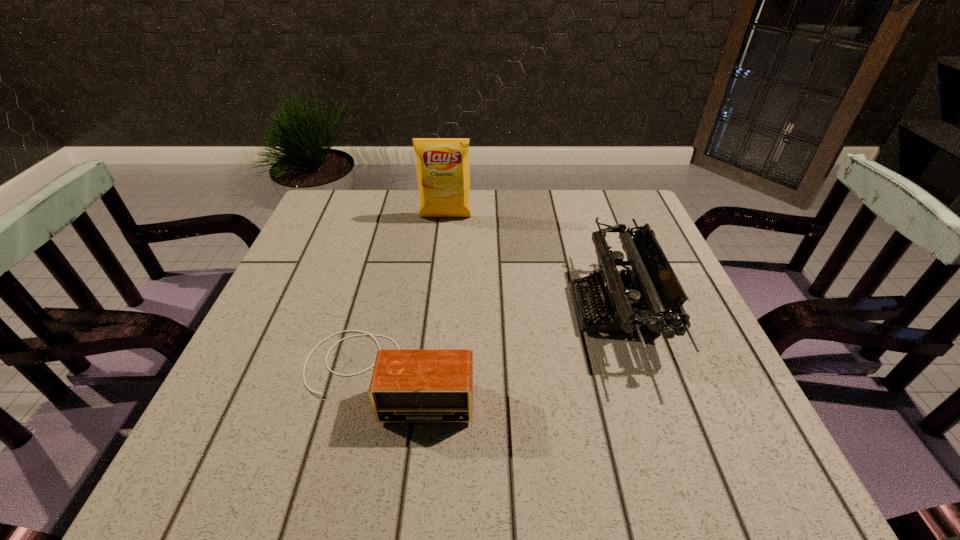
Locate an element on the screen. This screenshot has width=960, height=540. free space that satisfies the following two spatial constraints: 1. on the typing side of the rightmost object; 2. on the front-facing side of the shortest object is located at coordinates (636, 374).

Find the location of a particular element. free spot that satisfies the following two spatial constraints: 1. on the typing side of the second shortest object; 2. on the front-facing side of the radio receiver is located at coordinates (636, 374).

Identify the location of free location that satisfies the following two spatial constraints: 1. on the typing side of the rightmost object; 2. on the front-facing side of the shortest object. The width and height of the screenshot is (960, 540). (636, 374).

Locate an element on the screen. Image resolution: width=960 pixels, height=540 pixels. free space that satisfies the following two spatial constraints: 1. on the typing side of the second shortest object; 2. on the front-facing side of the shortest object is located at coordinates (636, 374).

Find the location of a particular element. The height and width of the screenshot is (540, 960). vacant space that satisfies the following two spatial constraints: 1. on the typing side of the typewriter; 2. on the front-facing side of the radio receiver is located at coordinates (636, 374).

The height and width of the screenshot is (540, 960). Find the location of `vacant position in the image that satisfies the following two spatial constraints: 1. on the typing side of the typewriter; 2. on the front-facing side of the radio receiver`. vacant position in the image that satisfies the following two spatial constraints: 1. on the typing side of the typewriter; 2. on the front-facing side of the radio receiver is located at coordinates (636, 374).